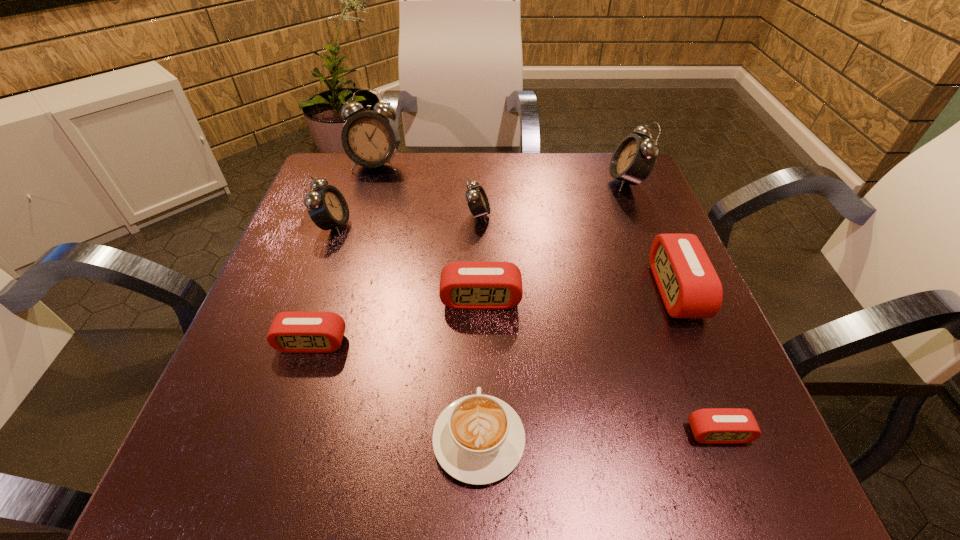
Locate an element on the screen. This screenshot has height=540, width=960. free region located on the face of the second white alarm clock from right to left is located at coordinates (578, 215).

Locate an element on the screen. This screenshot has height=540, width=960. vacant space located 0.350m on the front-facing side of the biggest pink alarm clock is located at coordinates (474, 291).

Locate an element on the screen. This screenshot has width=960, height=540. vacant space located 0.150m on the front-facing side of the biggest pink alarm clock is located at coordinates (579, 291).

This screenshot has height=540, width=960. Find the location of `vacant space situated on the front-facing side of the biggest pink alarm clock`. vacant space situated on the front-facing side of the biggest pink alarm clock is located at coordinates (621, 291).

I want to click on vacant space located 0.270m on the front-facing side of the third shortest alarm clock, so click(481, 458).

Identify the location of free location located on the front-facing side of the second shortest alarm clock. The width and height of the screenshot is (960, 540). (264, 491).

Locate an element on the screen. This screenshot has height=540, width=960. vacant space located 0.330m on the side of the cappuccino with the handle is located at coordinates (479, 254).

The image size is (960, 540). In order to click on vacant region located 0.220m on the side of the cappuccino with the handle in this screenshot , I will do `click(479, 293)`.

The image size is (960, 540). I want to click on vacant space located 0.360m on the side of the cappuccino with the handle, so 479,244.

Where is `cappuccino that is at the near edge`? This screenshot has width=960, height=540. cappuccino that is at the near edge is located at coordinates (478, 439).